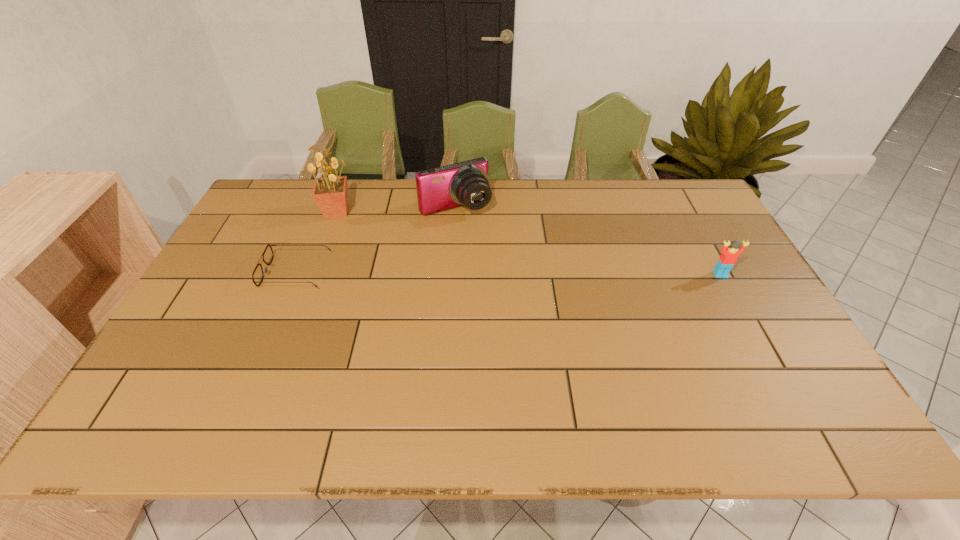
I want to click on vacant region located on the front-facing side of the camera, so click(x=478, y=234).

This screenshot has height=540, width=960. What are the coordinates of `vacant space positioned on the front-facing side of the camera` in the screenshot? It's located at (499, 264).

You are a GUI agent. You are given a task and a screenshot of the screen. Output one action in this format:
    pyautogui.click(x=<x>, y=<y>)
    Task: Click on the vacant area situated at the front of the sunflower with flowers visible
    
    Given the screenshot: What is the action you would take?
    [x=363, y=225]

Locate an element on the screen. This screenshot has height=540, width=960. free space located at the front of the sunflower with flowers visible is located at coordinates (370, 228).

I want to click on vacant space situated 0.150m at the front of the sunflower with flowers visible, so click(x=383, y=235).

Locate an element on the screen. camera situated at the far edge is located at coordinates (466, 183).

I want to click on sunflower located at the far edge, so click(x=330, y=193).

Where is `object that is positioned at the left edge`? The height and width of the screenshot is (540, 960). object that is positioned at the left edge is located at coordinates (257, 276).

Identify the location of object that is at the right edge. This screenshot has width=960, height=540. (728, 258).

Identify the location of free spot at the far edge of the desktop. (349, 189).